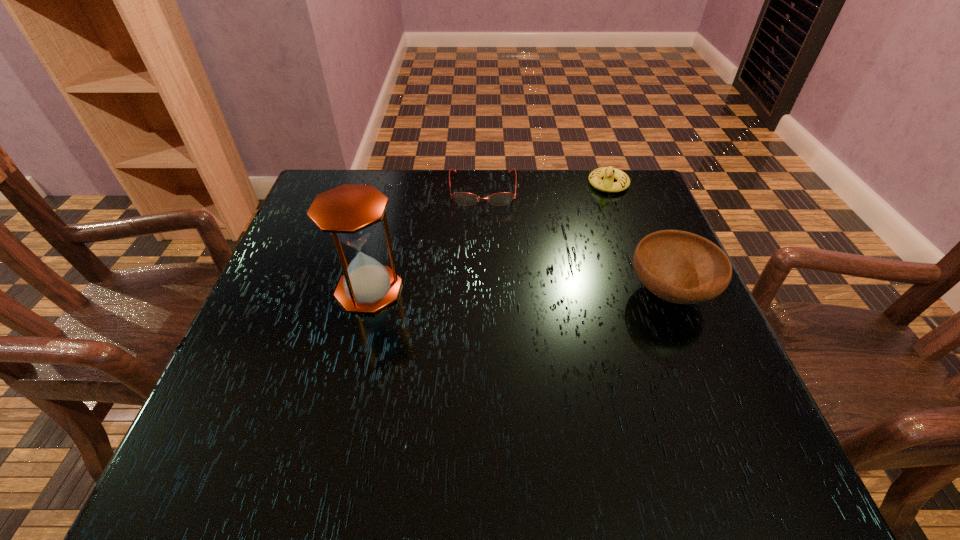
What are the coordinates of `free region at the far edge` in the screenshot? It's located at (485, 178).

The width and height of the screenshot is (960, 540). In the image, there is a desktop. In order to click on vacant space at the near edge in this screenshot , I will do `click(359, 418)`.

At what (x,y) coordinates should I click in order to perform the action: click on vacant region at the left edge of the desktop. Please return your answer as a coordinate pair (x, y). Looking at the image, I should click on (300, 278).

In the image, there is a desktop. Identify the location of free space at the right edge. (654, 356).

Find the location of `vacant space at the far left corner of the desktop`. vacant space at the far left corner of the desktop is located at coordinates (296, 219).

The height and width of the screenshot is (540, 960). In the image, there is a desktop. What are the coordinates of `vacant space at the far right corner` in the screenshot? It's located at (643, 203).

The width and height of the screenshot is (960, 540). In order to click on free space between the bowl and the second shortest object in this screenshot , I will do `click(638, 238)`.

The image size is (960, 540). Identify the location of vacant space that is in between the second object from left to right and the bowl. pyautogui.click(x=576, y=241).

Find the location of a particular element. This screenshot has height=540, width=960. vacant point located between the shortest object and the hourglass is located at coordinates tap(426, 240).

The width and height of the screenshot is (960, 540). Find the location of `empty space that is in between the second shortest object and the tallest object`. empty space that is in between the second shortest object and the tallest object is located at coordinates (489, 237).